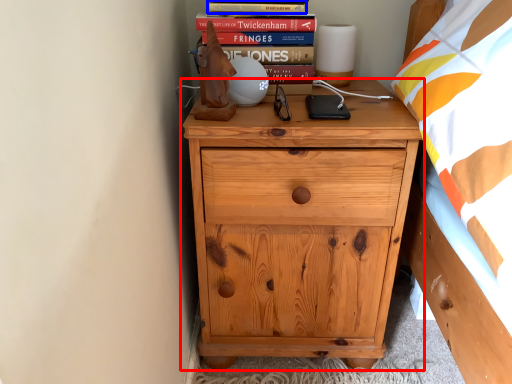
Question: Which point is closer to the camera, chest of drawers (highlighted by a red box) or paperback book (highlighted by a blue box)?

Choices:
 (A) chest of drawers
 (B) paperback book

Answer: (A)